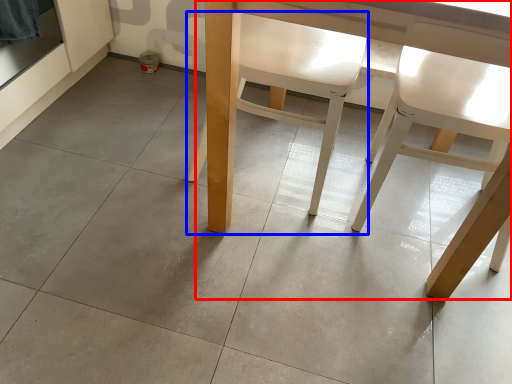
Question: Which object is closer to the camera taking this photo, table (highlighted by a red box) or chair (highlighted by a blue box)?

Choices:
 (A) table
 (B) chair

Answer: (A)